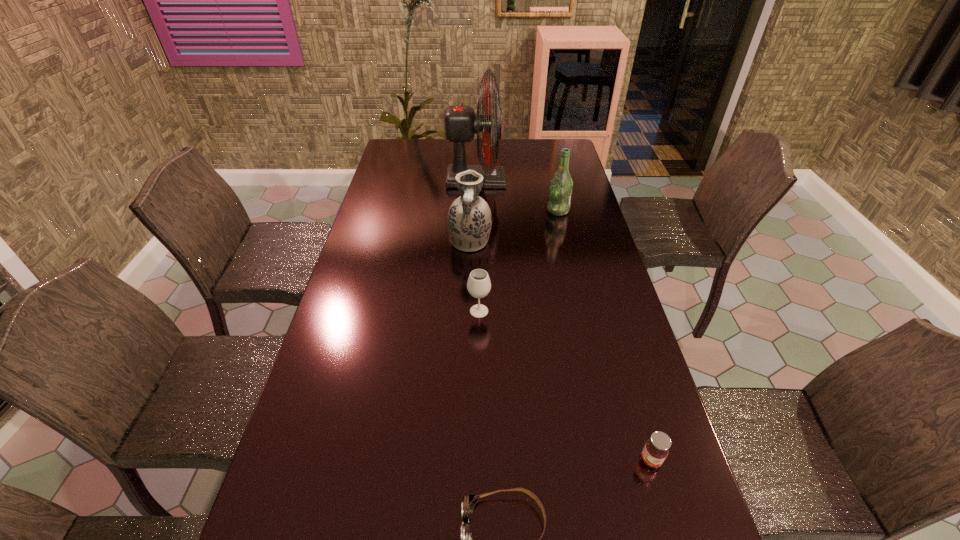
Locate an element on the screen. vacant area situated 0.290m on the surface of the beer bottle is located at coordinates (472, 211).

Image resolution: width=960 pixels, height=540 pixels. I want to click on free region located 0.180m on the surface of the beer bottle, so click(x=500, y=211).

Image resolution: width=960 pixels, height=540 pixels. I want to click on free space located 0.310m on the front of the third nearest object, so click(479, 415).

Where is `vacant position located 0.070m on the label side of the fifth tallest object`? The image size is (960, 540). vacant position located 0.070m on the label side of the fifth tallest object is located at coordinates (664, 504).

Find the location of `object at the far edge`. object at the far edge is located at coordinates (461, 123).

At what (x,y) coordinates should I click in order to perform the action: click on beer bottle present at the right edge. Please return your answer as a coordinate pair (x, y). Looking at the image, I should click on (561, 185).

This screenshot has width=960, height=540. I want to click on jam located in the right edge section of the desktop, so click(x=655, y=451).

Find the location of `vacant space at the far edge of the desktop`. vacant space at the far edge of the desktop is located at coordinates (475, 147).

Where is `vacant space at the left edge`? vacant space at the left edge is located at coordinates (349, 405).

The height and width of the screenshot is (540, 960). I want to click on vacant space at the right edge of the desktop, so click(x=607, y=453).